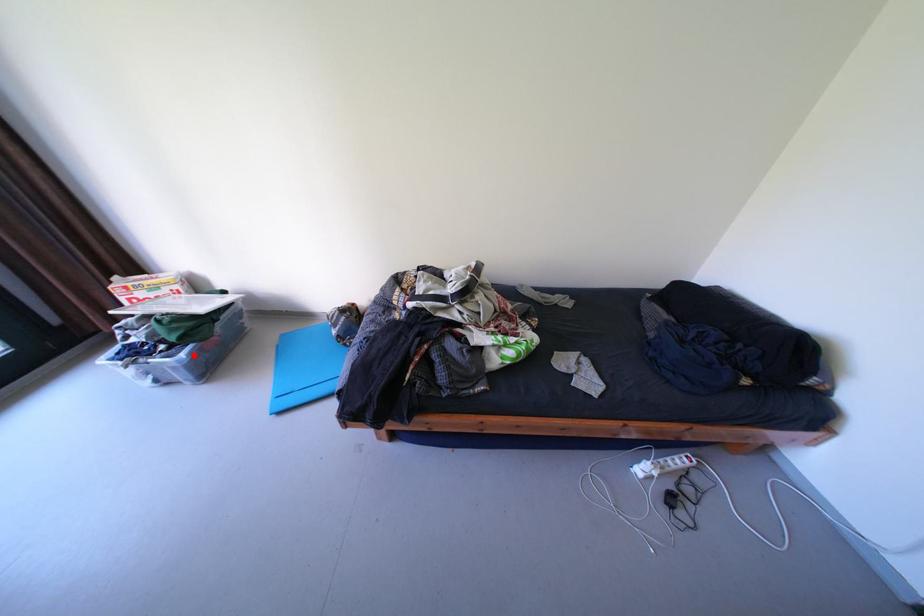
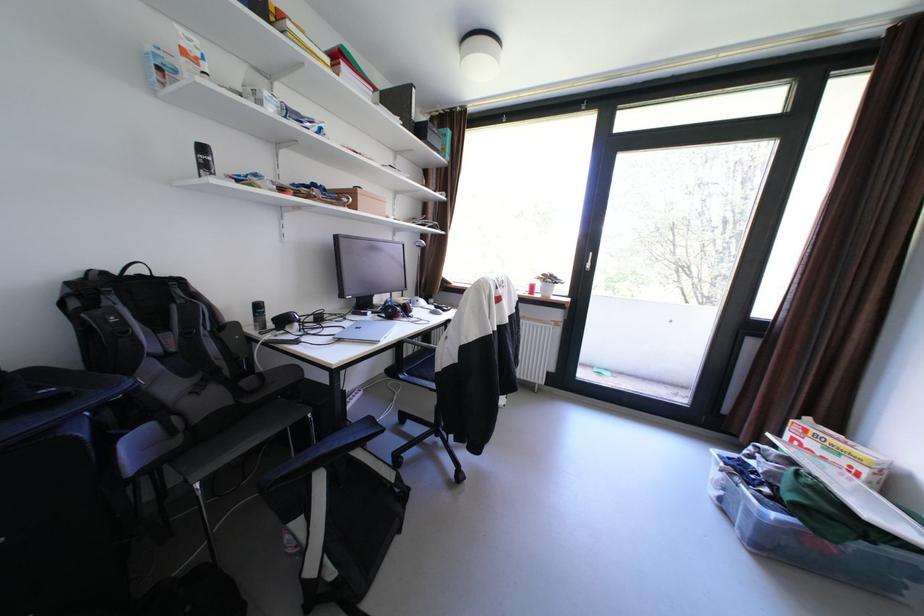
Question: I am providing you with two images of the same scene from different viewpoints. In image1, a red point is highlighted. Considering the same 3D point in image2, which of the following is correct?

Choices:
 (A) It is closer
 (B) It is farther

Answer: (A)